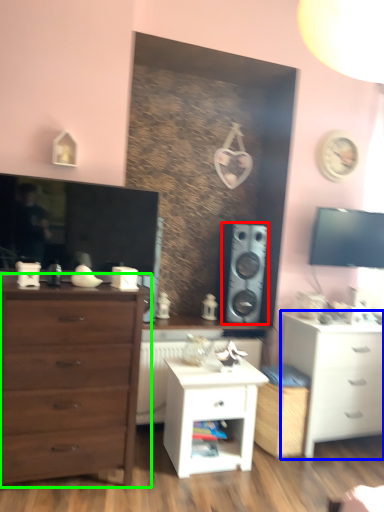
Question: Based on their relative distances, which object is nearer to speaker (highlighted by a red box)? Choose from chest of drawers (highlighted by a blue box) and chest of drawers (highlighted by a green box).

Choices:
 (A) chest of drawers
 (B) chest of drawers

Answer: (A)